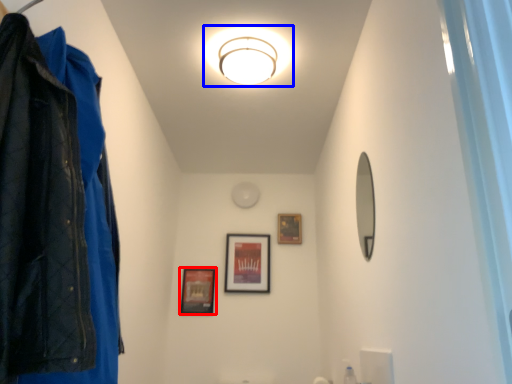
Question: Which point is further to the camera, picture frame (highlighted by a red box) or light fixture (highlighted by a blue box)?

Choices:
 (A) picture frame
 (B) light fixture

Answer: (A)